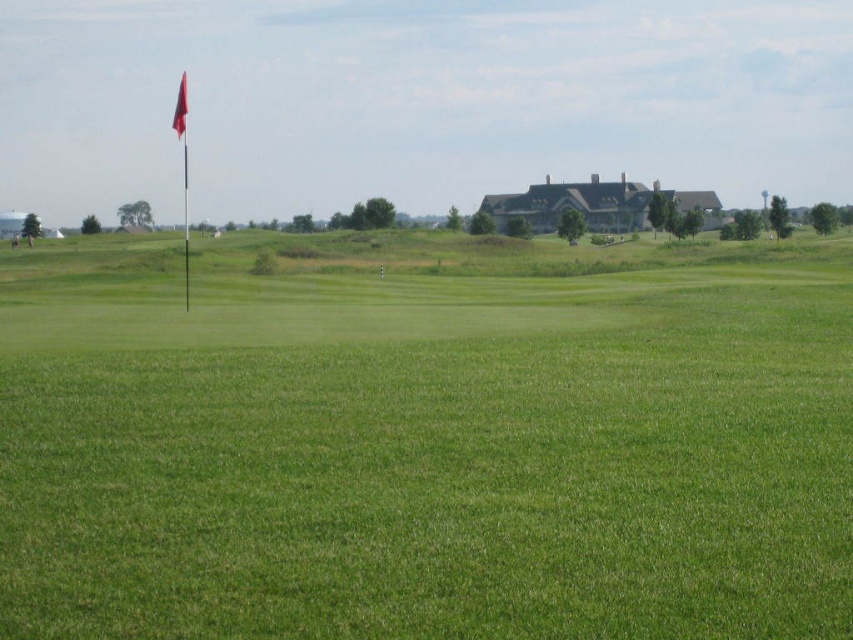
You are a golfer standing on the tee, preparing to hit your ball towards the putting green. You notice the green grass at center and the metallic flag pole at upper left. Which object is located lower in the image?

The green grass at center is located lower in the image than the metallic flag pole at upper left.

You are a golfer standing on the fairway and want to aim your shot towards the hole marked by the flag. Which object should you look at to determine the direction of the hole? The metallic flag pole at upper left or the red fabric flag at upper left?

You should look at the red fabric flag at upper left because it is positioned above the metallic flag pole at upper left and marks the hole.

You are a golfer standing on the green grass at center and want to hit the metallic flag pole at upper left. Considering the height difference between them, will you need to aim higher or lower to reach the flag pole?

The green grass at center has a lesser height compared to the metallic flag pole at upper left, so you need to aim higher to reach the flag pole.